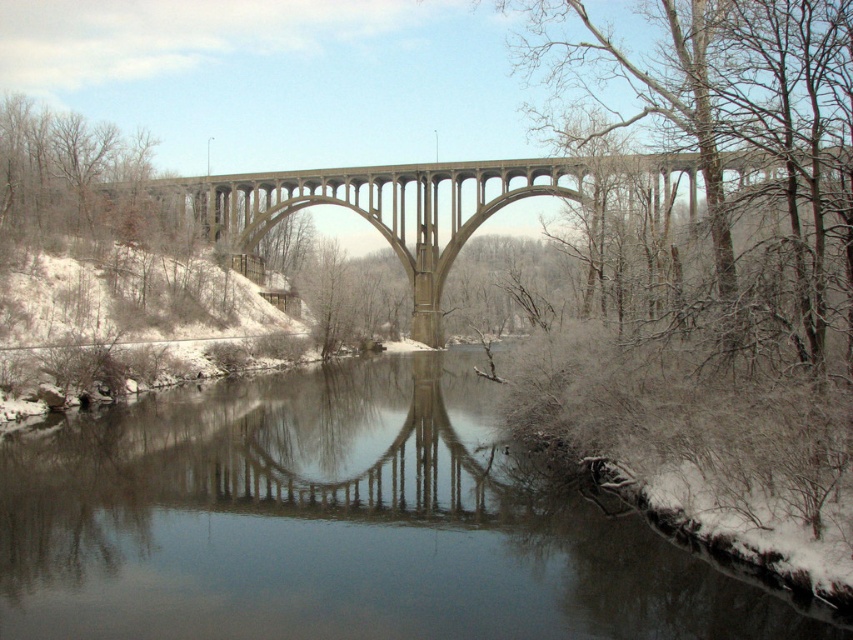
Question: Can you confirm if clear water at center is positioned below snow-covered branches at upper right?

Choices:
 (A) yes
 (B) no

Answer: (A)

Question: Among these points, which one is nearest to the camera?

Choices:
 (A) (486, 484)
 (B) (521, 196)

Answer: (A)

Question: Considering the real-world distances, which object is closest to the concrete bridge at center?

Choices:
 (A) clear water at center
 (B) snow-covered branches at upper right

Answer: (B)

Question: Considering the relative positions of snow-covered branches at upper right and concrete bridge at center in the image provided, where is snow-covered branches at upper right located with respect to concrete bridge at center?

Choices:
 (A) right
 (B) left

Answer: (A)

Question: In this image, where is snow-covered branches at upper right located relative to concrete bridge at center?

Choices:
 (A) left
 (B) right

Answer: (B)

Question: Among these points, which one is farthest from the camera?

Choices:
 (A) (314, 433)
 (B) (769, 51)

Answer: (A)